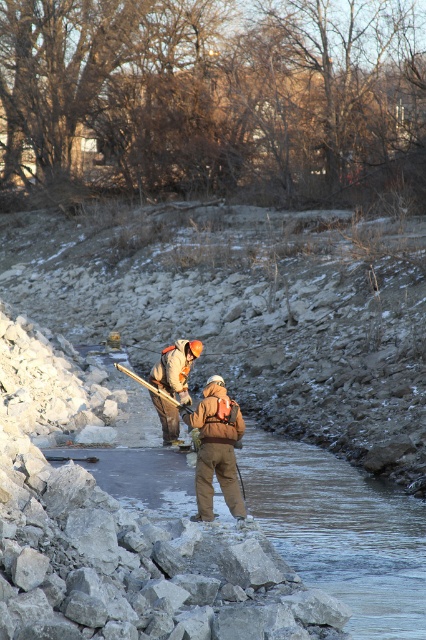
You are standing at the edge of the icy waterway and need to place a safety cone exactly at the location of the clear ice at center. According to the coordinates provided, where should you place the safety cone?

The clear ice at center should be placed at coordinates point (340, 531) as specified in the description.

You are standing at the point marked as point (x=340, y=531). What is the surface you are standing on?

The point (x=340, y=531) is on clear ice at center.